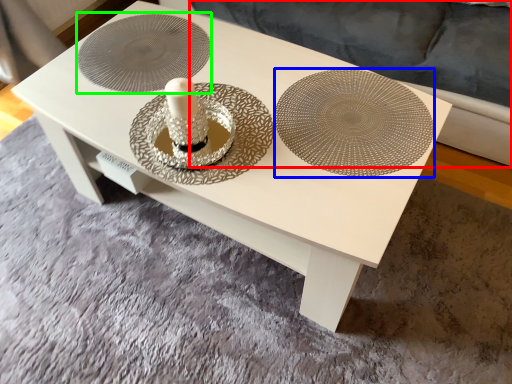
Question: Estimate the real-world distances between objects in this image. Which object is farther from couch (highlighted by a red box), plate (highlighted by a blue box) or circle (highlighted by a green box)?

Choices:
 (A) plate
 (B) circle

Answer: (B)